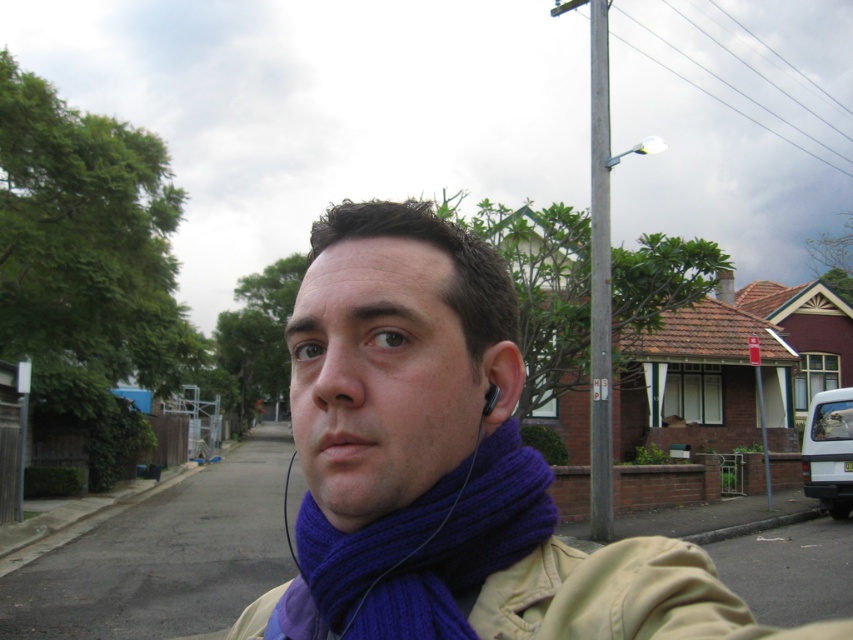
You are a photographer trying to capture the purple knitted scarf at center. The camera you are using has a focal length of 50mm. If you want to focus on the point marked by point (447, 465), which object in the scene should you adjust your focus to ensure the purple knitted scarf at center is sharp?

You should adjust your focus to the purple knitted scarf at center because the point (447, 465) marks its location, ensuring it will be sharp.